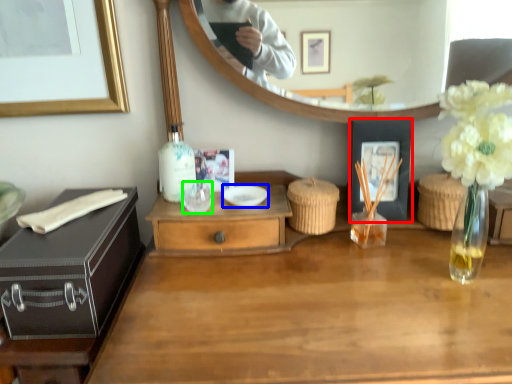
Question: Which is farther away from picture frame (highlighted by a red box)? bowl (highlighted by a blue box) or wine glass (highlighted by a green box)?

Choices:
 (A) bowl
 (B) wine glass

Answer: (B)